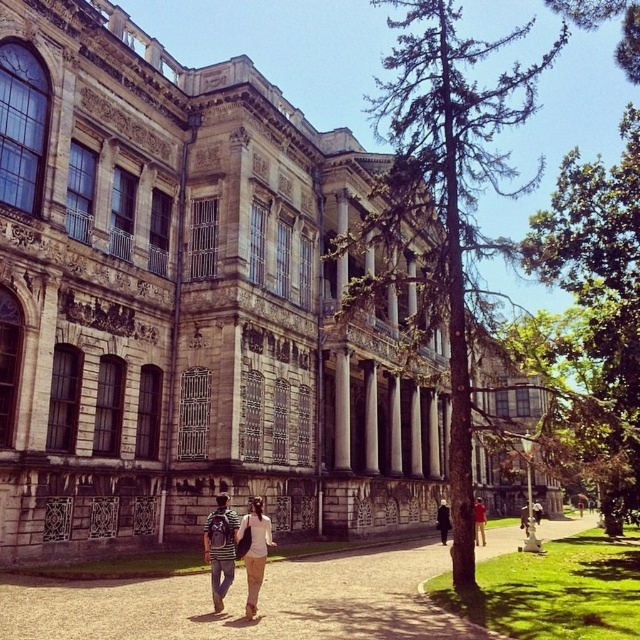
Consider the image. You are standing at the entrance of the historic building and see the green leafy tree at right and the striped cotton shirt at center. Which object is closer to you?

The striped cotton shirt at center is behind the green leafy tree at right, so the green leafy tree at right is closer to you.

You are standing at the entrance of the historic building and notice a green leafy tree at right and a striped cotton shirt at center. Which object is larger in size?

The green leafy tree at right is bigger than the striped cotton shirt at center.